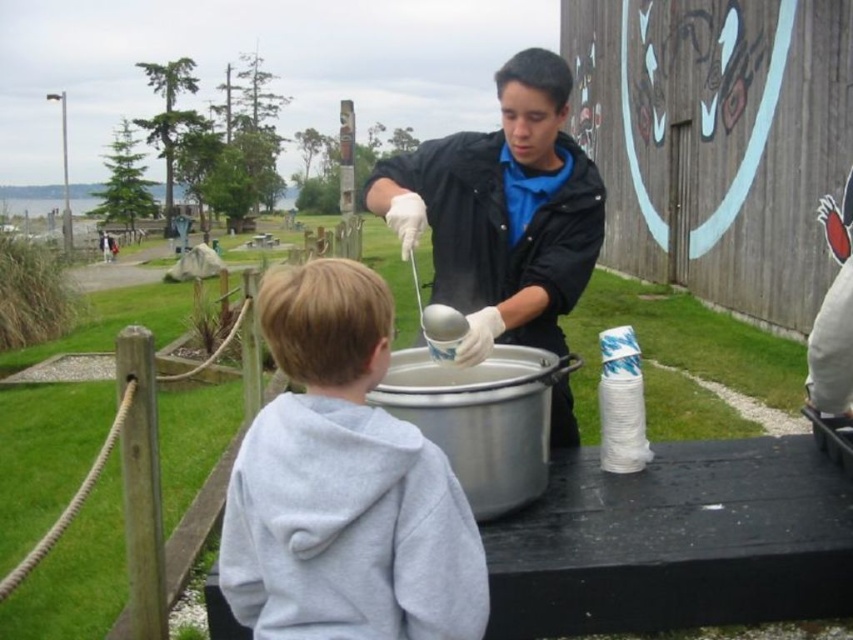
Question: From the image, what is the correct spatial relationship of gray fleece hoodie at lower left in relation to white glossy bowl at center?

Choices:
 (A) below
 (B) above

Answer: (A)

Question: Can you confirm if gray fleece hoodie at lower left is smaller than white glossy bowl at center?

Choices:
 (A) no
 (B) yes

Answer: (A)

Question: Is gray fleece hoodie at lower left closer to the viewer compared to white glossy bowl at center?

Choices:
 (A) yes
 (B) no

Answer: (A)